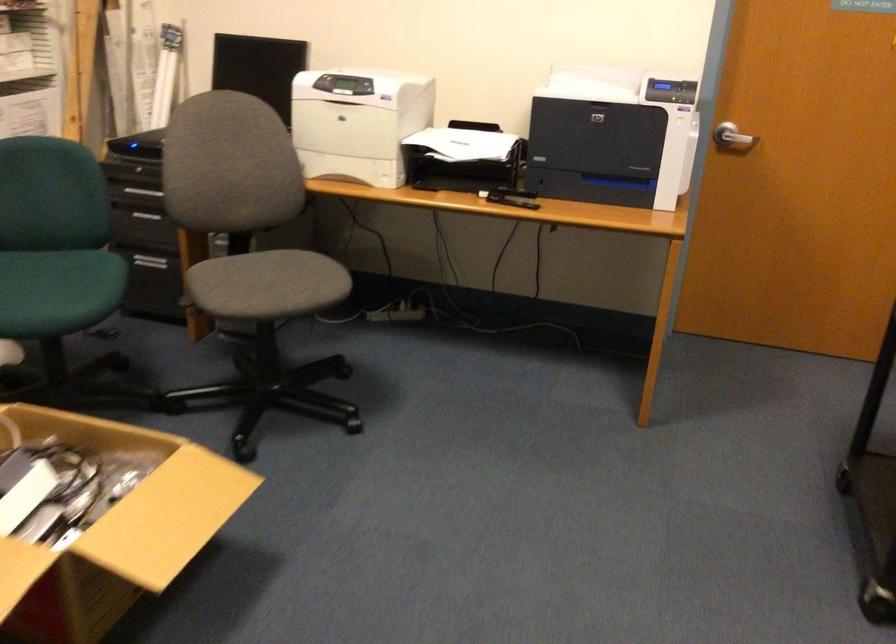
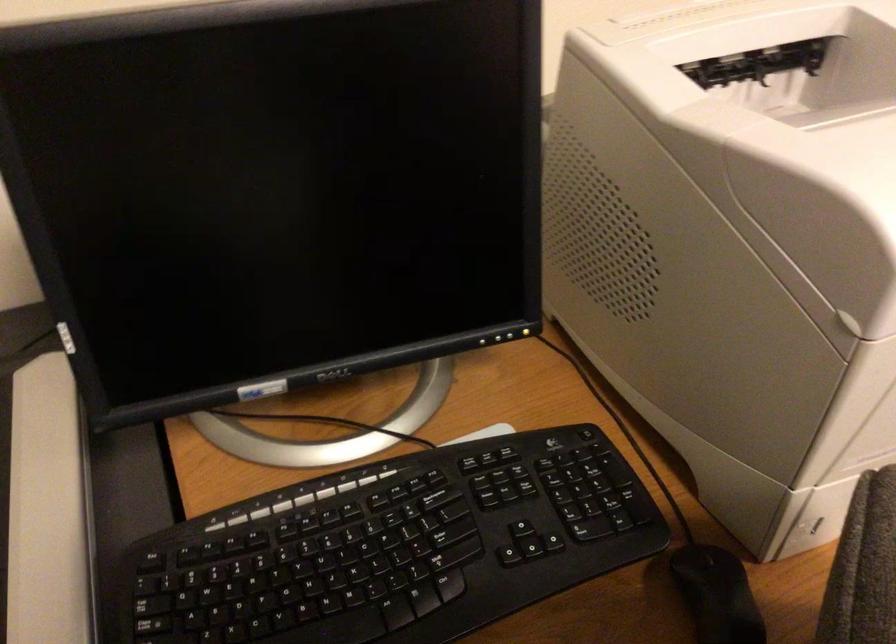
Find the pixel in the second image that matches [272,163] in the first image.

(717, 594)